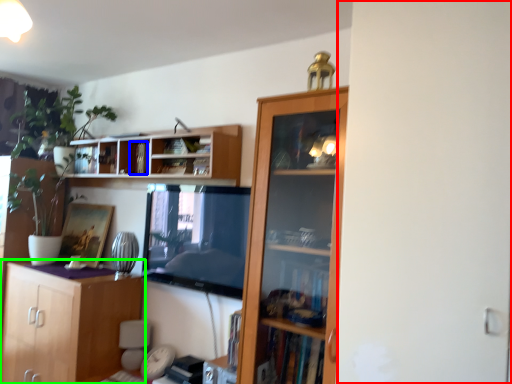
Question: Considering the real-world distances, which object is farthest from screen door (highlighted by a red box)? book (highlighted by a blue box) or cabinetry (highlighted by a green box)?

Choices:
 (A) book
 (B) cabinetry

Answer: (B)